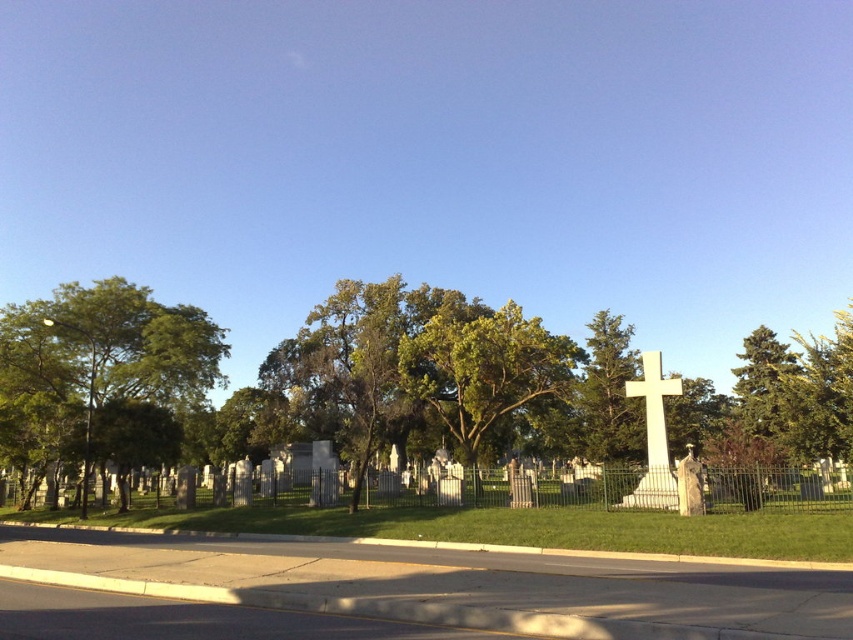
Who is more distant from viewer, (434, 346) or (654, 506)?

Positioned behind is point (434, 346).

Does green leafy tree at center have a larger size compared to white marble cross at right?

Indeed, green leafy tree at center has a larger size compared to white marble cross at right.

Is point (523, 388) positioned after point (662, 392)?

Yes, point (523, 388) is farther from viewer.

Identify the location of green leafy tree at center. (482, 365).

Between green leafy tree at left and green leafy tree at center, which one is positioned lower?

green leafy tree at center

Who is higher up, green leafy tree at left or green leafy tree at center?

green leafy tree at left

Between point (83, 484) and point (467, 417), which one is positioned behind?

The point (467, 417) is behind.

Image resolution: width=853 pixels, height=640 pixels. I want to click on green leafy tree at left, so click(102, 378).

Between point (192, 326) and point (659, 484), which one is positioned behind?

The point (192, 326) is more distant.

Who is lower down, green leafy tree at left or white marble cross at right?

white marble cross at right is below.

This screenshot has height=640, width=853. I want to click on green leafy tree at left, so click(102, 378).